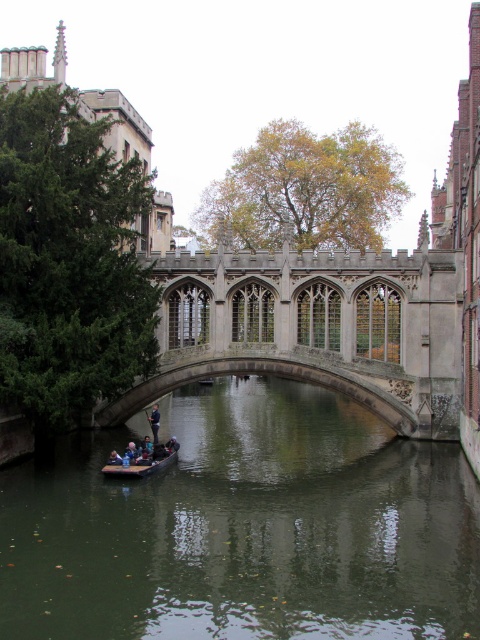
You are a passenger on the wooden canoe at center. You want to know if you can safely stand up without touching the green murky water at center. Can you do that?

The green murky water at center is taller than the wooden canoe at center, so the water level is higher than the canoe. This means standing up might cause the canoe to tip over or the water to spill in, so it is not safe to stand up.

You are a photographer planning to capture the historic stone bridge and the passengers on the punt. Based on the scene, which object would appear bigger in your photo, the stone gothic bridge at center or the dark blue fabric jacket at center?

The stone gothic bridge at center appears bigger in the photo because it has a larger size compared to the dark blue fabric jacket at center.

You are a tourist standing on the bank of the river and want to take a photo of the stone gothic bridge at center and the dark blue fabric jacket at center. Since you want both subjects in focus, which one should you focus on first to ensure the other is also in sharpness?

You should focus on the stone gothic bridge at center first because the dark blue fabric jacket at center is behind it, so if the bridge is in focus, the jacket behind will also be sharp.